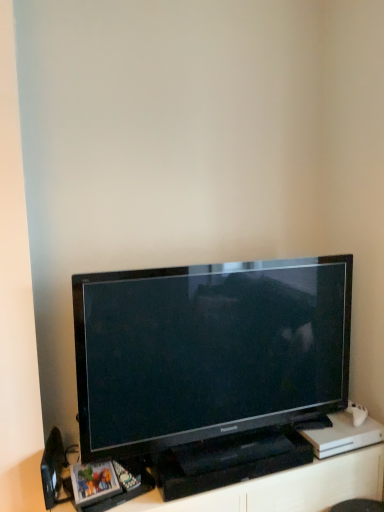
Question: From the image's perspective, is black plastic speaker at lower left located above black plastic entertainment center at lower center?

Choices:
 (A) yes
 (B) no

Answer: (A)

Question: Can you confirm if black plastic speaker at lower left is smaller than black plastic entertainment center at lower center?

Choices:
 (A) yes
 (B) no

Answer: (A)

Question: Does black plastic speaker at lower left have a greater width compared to black plastic entertainment center at lower center?

Choices:
 (A) yes
 (B) no

Answer: (B)

Question: Is black plastic speaker at lower left next to black plastic entertainment center at lower center?

Choices:
 (A) no
 (B) yes

Answer: (A)

Question: Is black plastic speaker at lower left shorter than black plastic entertainment center at lower center?

Choices:
 (A) no
 (B) yes

Answer: (B)

Question: Considering the positions of black glossy television at center and black plastic speaker at lower left in the image, is black glossy television at center bigger or smaller than black plastic speaker at lower left?

Choices:
 (A) big
 (B) small

Answer: (A)

Question: From a real-world perspective, is black glossy television at center above or below black plastic speaker at lower left?

Choices:
 (A) below
 (B) above

Answer: (B)

Question: Considering the positions of point (253, 372) and point (59, 436), is point (253, 372) closer or farther from the camera than point (59, 436)?

Choices:
 (A) closer
 (B) farther

Answer: (B)

Question: Is black glossy television at center situated inside black plastic speaker at lower left or outside?

Choices:
 (A) outside
 (B) inside

Answer: (A)

Question: Do you think black plastic speaker at lower left is within black plastic entertainment center at lower center, or outside of it?

Choices:
 (A) inside
 (B) outside

Answer: (B)

Question: In terms of size, does black plastic speaker at lower left appear bigger or smaller than black plastic entertainment center at lower center?

Choices:
 (A) small
 (B) big

Answer: (A)

Question: Is black plastic speaker at lower left wider or thinner than black plastic entertainment center at lower center?

Choices:
 (A) wide
 (B) thin

Answer: (B)

Question: Considering their positions, is black plastic speaker at lower left located in front of or behind black plastic entertainment center at lower center?

Choices:
 (A) behind
 (B) front

Answer: (A)

Question: From a real-world perspective, is black plastic entertainment center at lower center above or below black glossy television at center?

Choices:
 (A) below
 (B) above

Answer: (A)

Question: Considering their positions, is black plastic entertainment center at lower center located in front of or behind black glossy television at center?

Choices:
 (A) front
 (B) behind

Answer: (B)